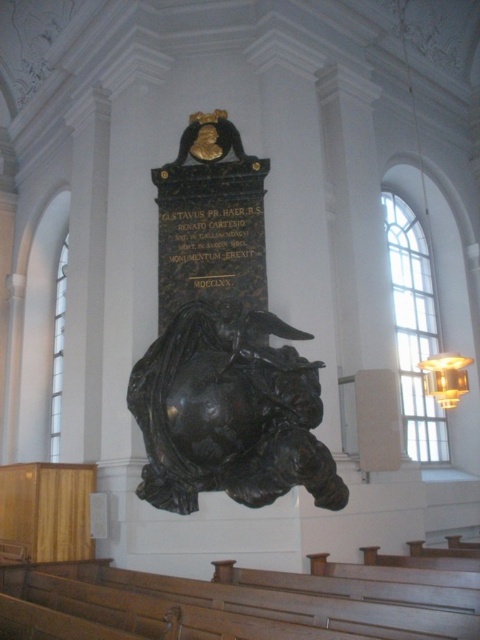
Question: Is black polished stone sculpture at center below black stone plaque at center?

Choices:
 (A) no
 (B) yes

Answer: (B)

Question: Can you confirm if black polished stone sculpture at center is positioned below black stone plaque at center?

Choices:
 (A) yes
 (B) no

Answer: (A)

Question: Is black polished stone sculpture at center closer to the viewer compared to black stone plaque at center?

Choices:
 (A) yes
 (B) no

Answer: (A)